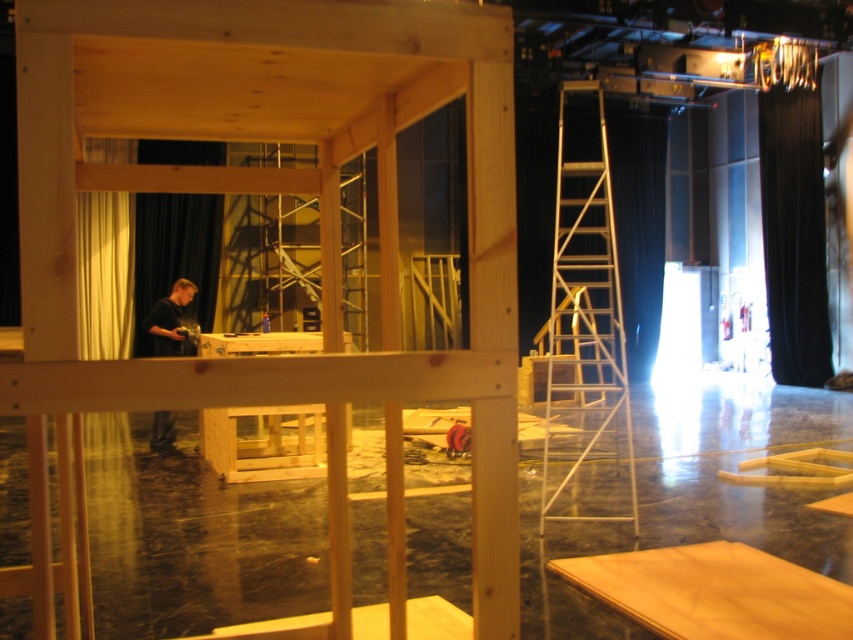
Question: Among these objects, which one is farthest from the camera?

Choices:
 (A) black velvet curtain at right
 (B) silver metallic ladder at right
 (C) dark brown wood man at left

Answer: (A)

Question: Is silver metallic ladder at right smaller than black velvet curtain at right?

Choices:
 (A) no
 (B) yes

Answer: (A)

Question: Which point is farther from the camera taking this photo?

Choices:
 (A) (813, 176)
 (B) (177, 278)
 (C) (624, 476)

Answer: (B)

Question: In this image, where is silver metallic ladder at right located relative to black velvet curtain at right?

Choices:
 (A) right
 (B) left

Answer: (B)

Question: Which object is farther from the camera taking this photo?

Choices:
 (A) silver metallic ladder at right
 (B) dark brown wood man at left
 (C) black velvet curtain at right

Answer: (C)

Question: Is silver metallic ladder at right thinner than black velvet curtain at right?

Choices:
 (A) no
 (B) yes

Answer: (A)